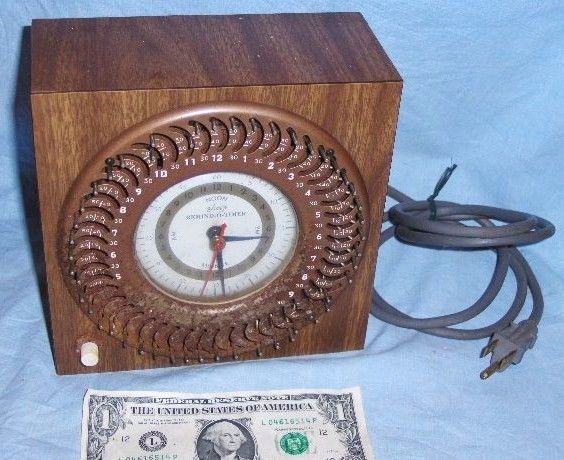
The image size is (564, 460). I want to click on long black clock arm, so click(x=218, y=260).